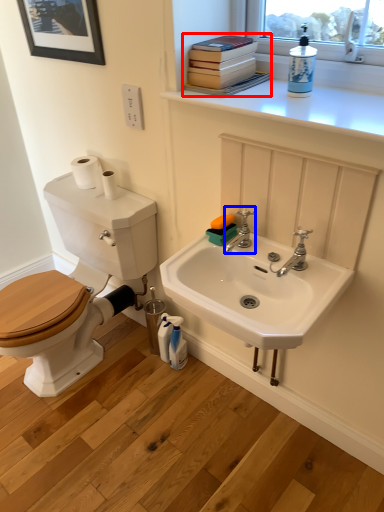
Question: Which point is closer to the camera, book (highlighted by a red box) or tap (highlighted by a blue box)?

Choices:
 (A) book
 (B) tap

Answer: (A)